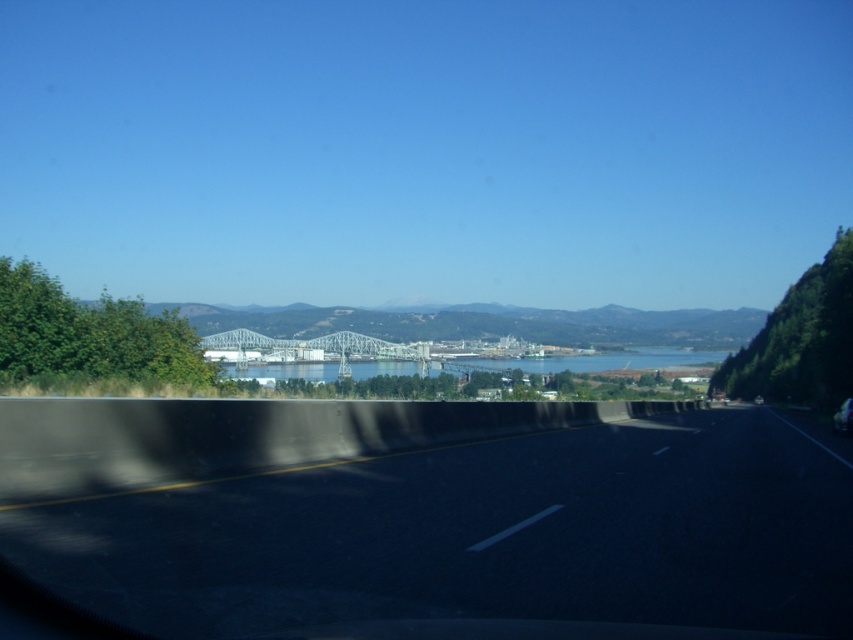
Is black asphalt highway at center below blue water at center?

Actually, black asphalt highway at center is above blue water at center.

Can you confirm if black asphalt highway at center is positioned above blue water at center?

Correct, black asphalt highway at center is located above blue water at center.

Locate an element on the screen. black asphalt highway at center is located at coordinates (424, 515).

You are a GUI agent. You are given a task and a screenshot of the screen. Output one action in this format:
    pyautogui.click(x=<x>, y=<y>)
    Task: Click on the black asphalt highway at center
    
    Given the screenshot: What is the action you would take?
    pyautogui.click(x=424, y=515)

Is point (436, 404) positioned in front of point (846, 410)?

Yes, point (436, 404) is closer to viewer.

Who is higher up, black asphalt highway at center or metallic silver car at center?

Positioned higher is black asphalt highway at center.

Where is `black asphalt highway at center`? This screenshot has height=640, width=853. black asphalt highway at center is located at coordinates (424, 515).

Does blue water at center appear under metallic silver car at center?

Yes, blue water at center is below metallic silver car at center.

I want to click on blue water at center, so click(614, 362).